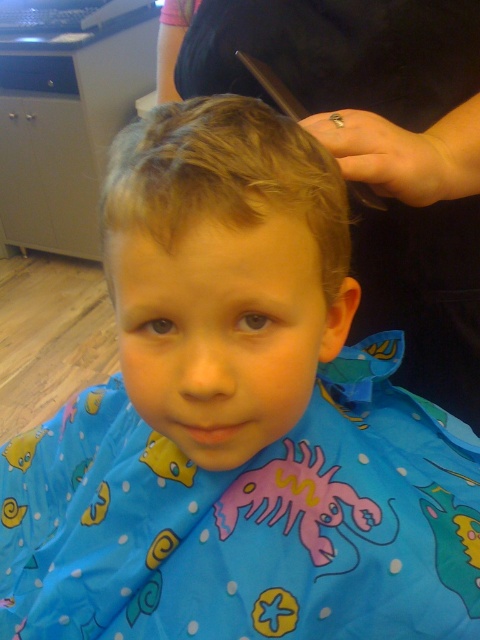
You are a customer entering a hair salon and see the black fabric at upper center and the blonde smooth hair at center. Which object is closer to you?

The black fabric at upper center is closer to you because it is further to the viewer than the blonde smooth hair at center.

You are a hair stylist who needs to place a new cape on the child. The new cape is 40 centimeters long. Will the cape reach the black fabric at upper center?

The black fabric at upper center is 44.44 centimeters away from the viewer. Since the new cape is only 40 centimeters long, it will not reach the black fabric at upper center.